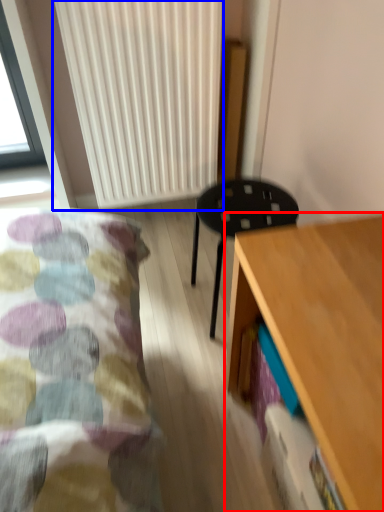
Question: Which object is closer to the camera taking this photo, desk (highlighted by a red box) or radiator (highlighted by a blue box)?

Choices:
 (A) desk
 (B) radiator

Answer: (A)